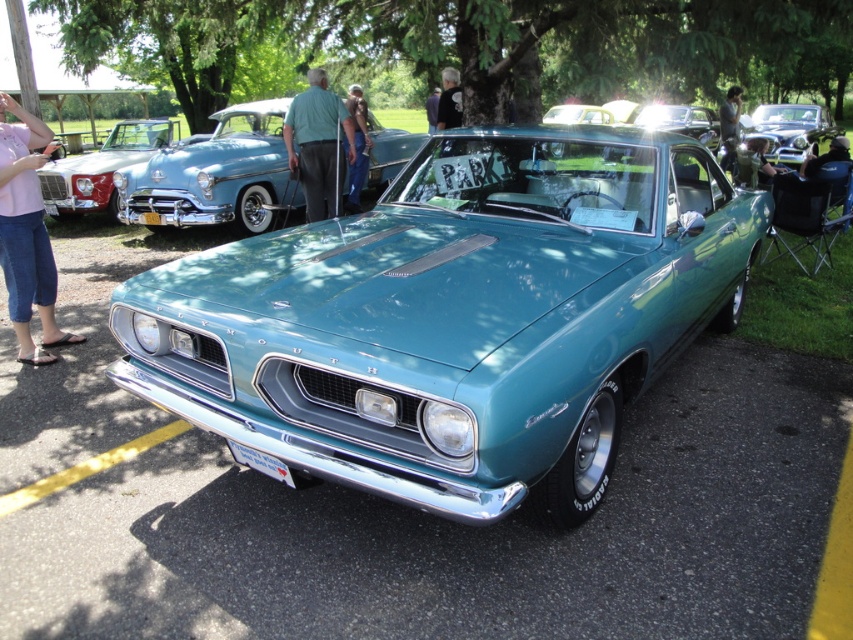
Is pink fabric shirt at left wider than green fabric jacket at center?

Correct, the width of pink fabric shirt at left exceeds that of green fabric jacket at center.

Between point (39, 134) and point (775, 173), which one is positioned in front?

Point (39, 134) is more forward.

Which is in front, point (47, 337) or point (772, 164)?

Point (47, 337) is more forward.

Find the location of a particular element. Image resolution: width=853 pixels, height=640 pixels. pink fabric shirt at left is located at coordinates coord(26,234).

Does green fabric shirt at center have a greater height compared to matte white car at left?

No, green fabric shirt at center is not taller than matte white car at left.

Looking at this image, does green fabric shirt at center have a lesser width compared to matte white car at left?

Indeed, green fabric shirt at center has a lesser width compared to matte white car at left.

Does point (288, 106) lie behind point (96, 170)?

No, it is in front of (96, 170).

Locate an element on the screen. The height and width of the screenshot is (640, 853). green fabric shirt at center is located at coordinates (318, 145).

Is point (134, 138) positioned in front of point (808, 156)?

Yes, it is.

Is matte white car at left above matte black jacket at center?

No, matte white car at left is not above matte black jacket at center.

Which is in front, point (135, 144) or point (845, 147)?

Point (845, 147) is more forward.

Find the location of a particular element. Image resolution: width=853 pixels, height=640 pixels. matte white car at left is located at coordinates (102, 168).